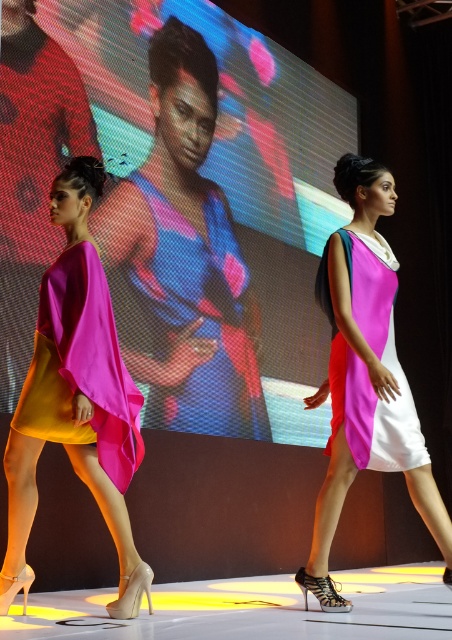
You are a photographer at the back of the runway. You want to take a clear photo of the shiny metallic shoes at center without the matte blue dress at center blocking it. Is this possible?

The shiny metallic shoes at center is behind the matte blue dress at center, so it will be blocked by the dress. Therefore, you cannot take a clear photo of the shiny metallic shoes at center without the matte blue dress at center blocking it.

You are a photographer standing at the back of the runway. You want to take a closeup shot of the matte blue dress at center. Given that your camera can focus on objects within 10 feet, will you be able to capture a clear closeup?

The matte blue dress at center is 15.54 feet away from the camera, which is beyond the camera focus range of 10 feet. Therefore, you cannot capture a clear closeup.

You are a photographer at a fashion show and need to capture both the matte blue dress at center and the pink satin dress at center in a single frame. Given that your camera has a fixed focal length and limited horizontal field of view, which dress should you position closer to the center of the frame to ensure both are fully visible?

The matte blue dress at center is wider than the pink satin dress at center. To ensure both are fully visible in the frame, position the wider matte blue dress at center closer to the center of the frame so that it occupies less space, allowing the narrower pink satin dress at center to fit within the field of view.